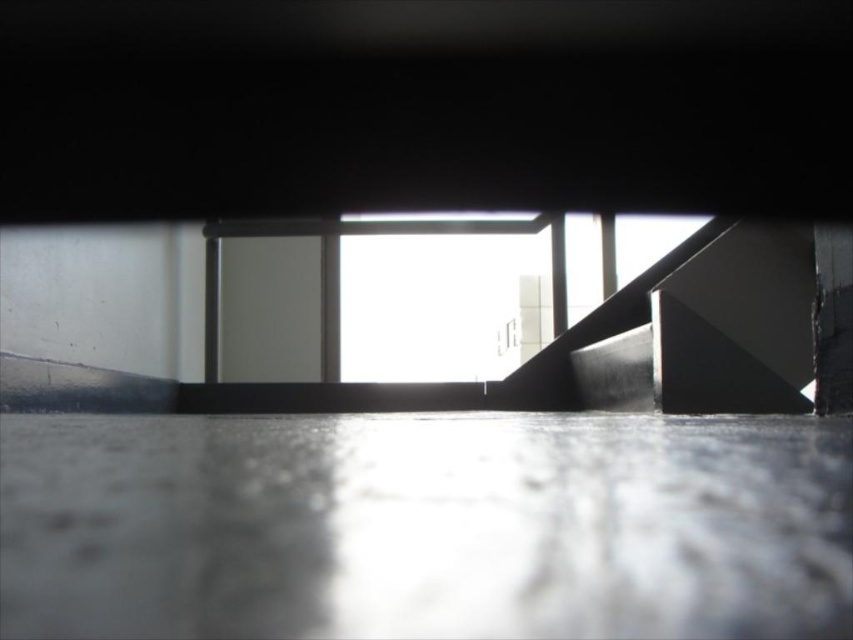
Question: Does matte black stair at right have a smaller size compared to transparent glass window at center?

Choices:
 (A) no
 (B) yes

Answer: (B)

Question: Does matte black stair at right appear under transparent glass window at center?

Choices:
 (A) yes
 (B) no

Answer: (A)

Question: Does matte black stair at right lie behind transparent glass window at center?

Choices:
 (A) yes
 (B) no

Answer: (B)

Question: Among these objects, which one is nearest to the camera?

Choices:
 (A) transparent glass window at center
 (B) matte black stair at right

Answer: (B)

Question: Which object appears closest to the camera in this image?

Choices:
 (A) matte black stair at right
 (B) transparent glass window at center

Answer: (A)